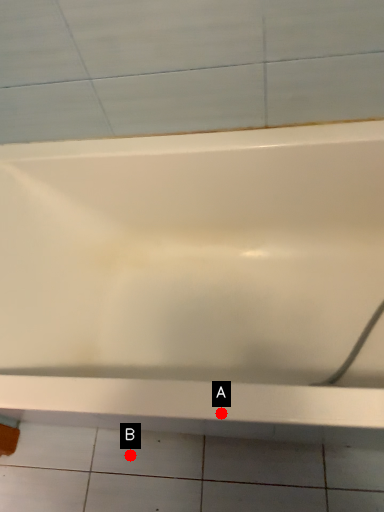
Question: Two points are circled on the image, labeled by A and B beside each circle. Which of the following is the closest to the observer?

Choices:
 (A) A is closer
 (B) B is closer

Answer: (A)